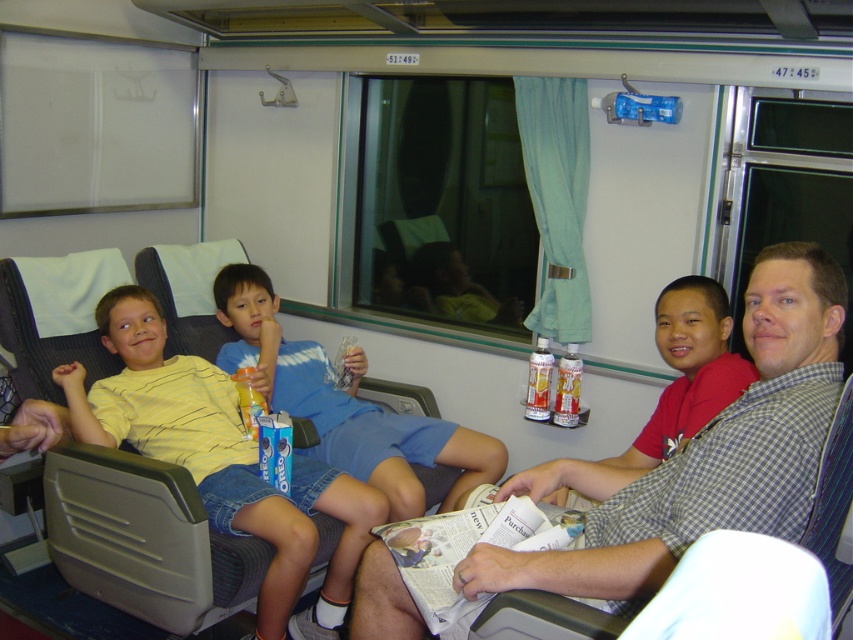
Is point (84, 422) more distant than point (422, 438)?

No, it is not.

Does yellow striped shirt at left have a lesser width compared to blue denim shorts at center?

Yes.

Does point (186, 458) come closer to viewer compared to point (281, 396)?

That is True.

The width and height of the screenshot is (853, 640). Find the location of `yellow striped shirt at left`. yellow striped shirt at left is located at coordinates pyautogui.click(x=219, y=458).

Can you confirm if checkered fabric shirt at center is thinner than blue denim shorts at center?

Yes.

This screenshot has width=853, height=640. Find the location of `checkered fabric shirt at center`. checkered fabric shirt at center is located at coordinates (700, 454).

Measure the distance between yellow striped shirt at left and camera.

yellow striped shirt at left and camera are 2.07 meters apart.

Which is above, yellow striped shirt at left or red cotton shirt at right?

red cotton shirt at right

The width and height of the screenshot is (853, 640). What do you see at coordinates (219, 458) in the screenshot? I see `yellow striped shirt at left` at bounding box center [219, 458].

Image resolution: width=853 pixels, height=640 pixels. I want to click on yellow striped shirt at left, so click(x=219, y=458).